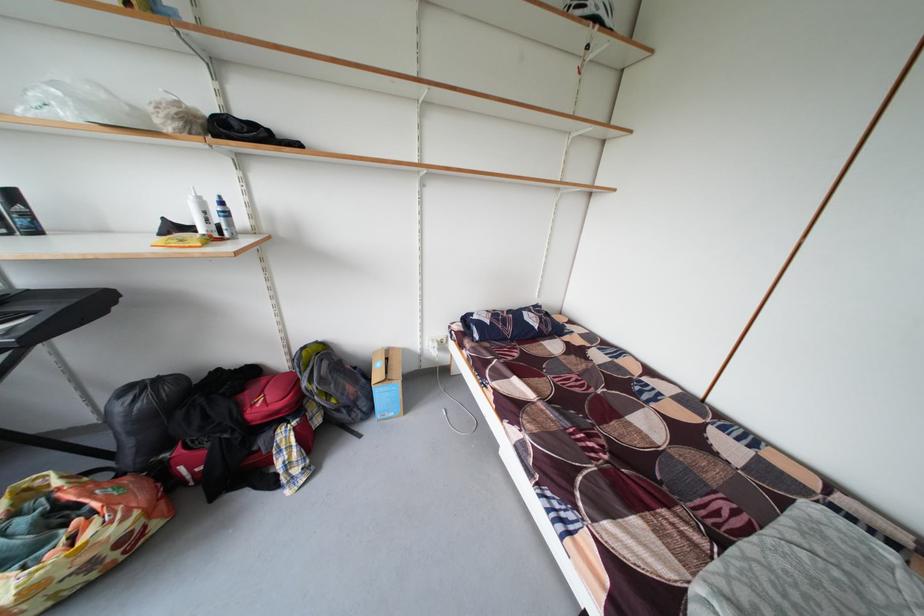
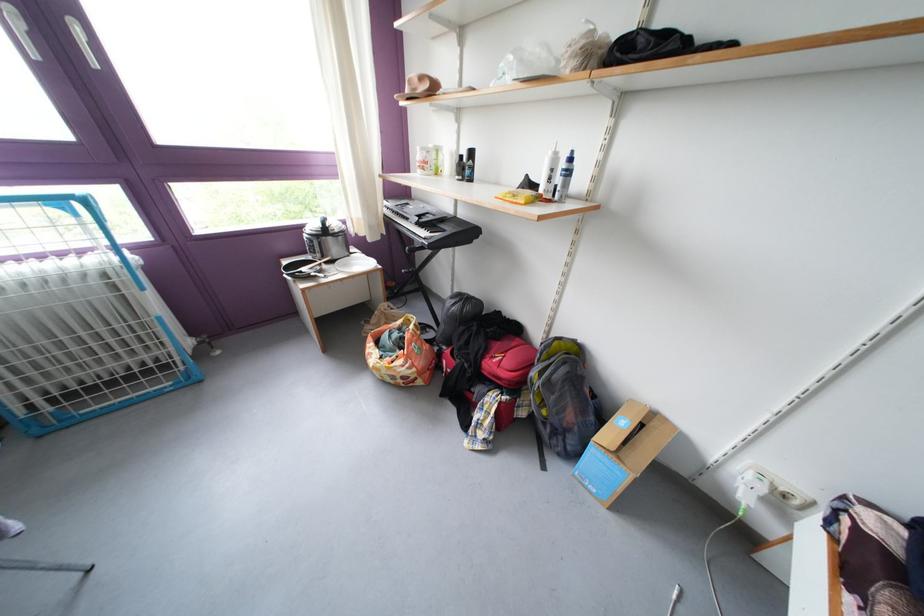
Locate, in the second image, the point that corresponds to point (225, 213) in the first image.

(573, 169)